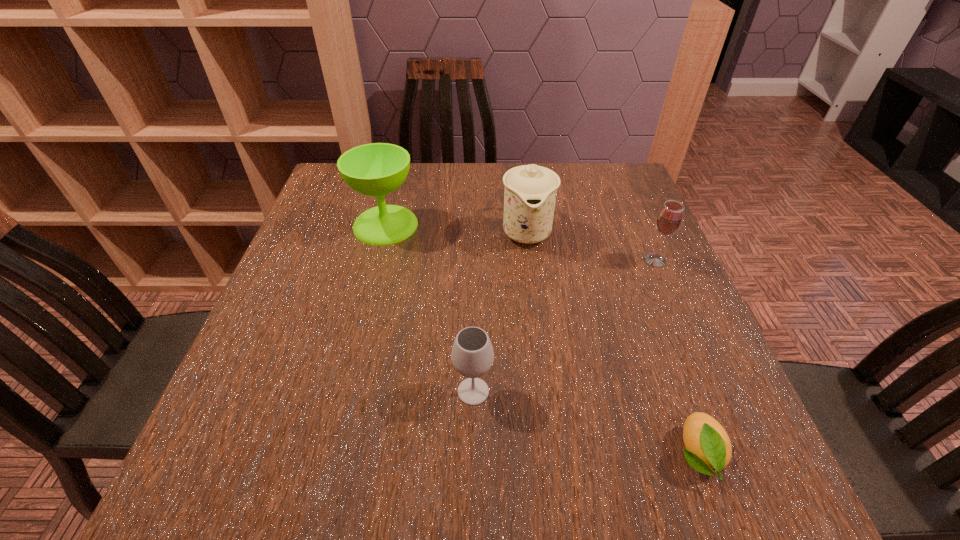
The image size is (960, 540). In order to click on free spot at the far edge of the desktop in this screenshot , I will do `click(449, 175)`.

In the image, there is a desktop. Identify the location of vacant space at the left edge. The image size is (960, 540). (344, 239).

In the image, there is a desktop. Find the location of `vacant space at the right edge`. vacant space at the right edge is located at coordinates (651, 298).

I want to click on vacant area at the far left corner, so click(x=318, y=202).

In the image, there is a desktop. Identify the location of vacant space at the far right corner. This screenshot has width=960, height=540. (591, 195).

In order to click on vacant space at the near right corner of the desktop in this screenshot , I will do `click(688, 500)`.

Image resolution: width=960 pixels, height=540 pixels. What are the coordinates of `vacant area between the shortest object and the rightmost wineglass` in the screenshot? It's located at (676, 357).

Locate an element on the screen. The width and height of the screenshot is (960, 540). unoccupied position between the chinaware and the second nearest wineglass is located at coordinates (590, 246).

What are the coordinates of `free space between the nearest wineglass and the tallest wineglass` in the screenshot? It's located at pos(429,308).

The width and height of the screenshot is (960, 540). What are the coordinates of `empty location between the third object from left to right and the shortest object` in the screenshot? It's located at (612, 343).